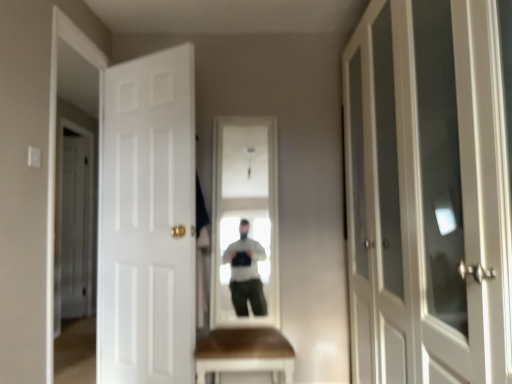
Question: From their relative heights in the image, would you say white glass cabinet at right, the 3th door from the left, is taller or shorter than white matte door at left, the 2th door positioned from the right?

Choices:
 (A) short
 (B) tall

Answer: (A)

Question: Is white glass cabinet at right, which is counted as the 1th door, starting from the right, wider or thinner than white matte door at left, which is the 2th door from left to right?

Choices:
 (A) thin
 (B) wide

Answer: (B)

Question: Which object is positioned farthest from the white wood door at left, the third door in the front-to-back sequence?

Choices:
 (A) white glass cabinet at right, marked as the first door in a front-to-back arrangement
 (B) white matte door at left, the 2th door positioned from the right

Answer: (A)

Question: Which is nearer to the white glass cabinet at right, marked as the first door in a front-to-back arrangement?

Choices:
 (A) white wood door at left, the first door when ordered from left to right
 (B) white matte door at left, the 2th door positioned from the right

Answer: (B)